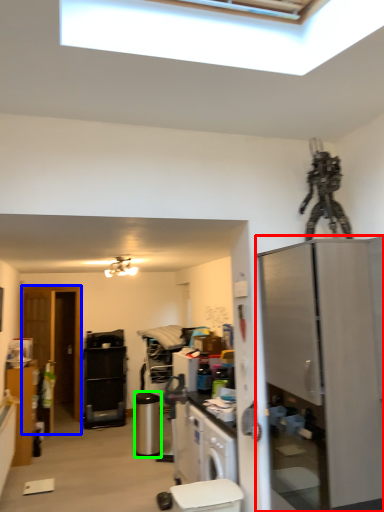
Question: Which object is positioned closest to refrigerator (highlighted by a red box)? Select from glass door (highlighted by a blue box) and appliance (highlighted by a green box).

Choices:
 (A) glass door
 (B) appliance

Answer: (B)